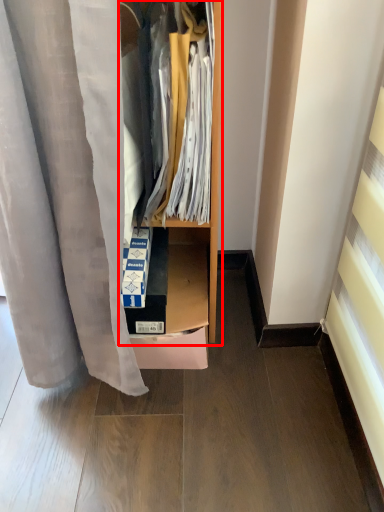
Question: Where is dresser (annotated by the red box) located in relation to shelf in the image?

Choices:
 (A) left
 (B) right

Answer: (B)